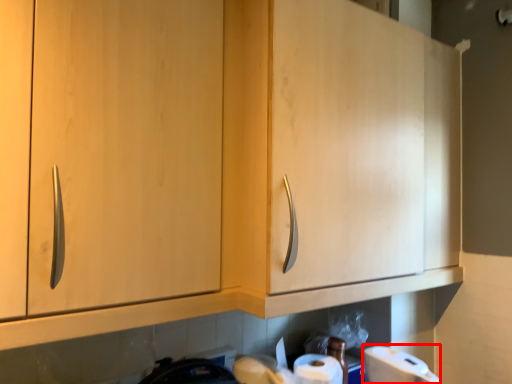
Question: From the image's perspective, what is the correct spatial relationship of toilet paper (annotated by the red box) in relation to cabinetry?

Choices:
 (A) below
 (B) above

Answer: (A)